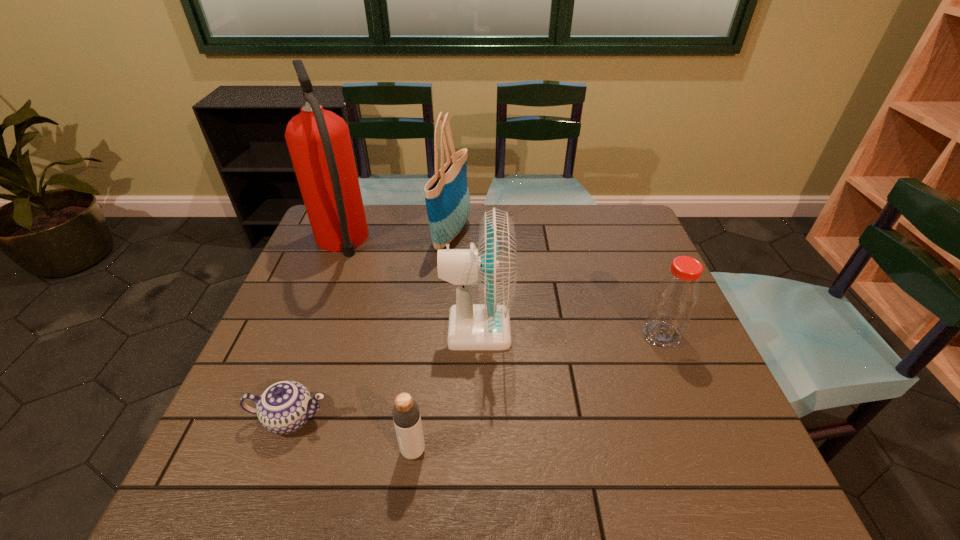
Where is `free point at the far edge`? The width and height of the screenshot is (960, 540). free point at the far edge is located at coordinates (372, 230).

The height and width of the screenshot is (540, 960). Identify the location of vacant region at the near edge of the desktop. (329, 500).

Identify the location of vacant space at the left edge. The width and height of the screenshot is (960, 540). (345, 286).

The height and width of the screenshot is (540, 960). In order to click on blank space at the right edge of the desktop in this screenshot , I will do `click(653, 281)`.

The width and height of the screenshot is (960, 540). I want to click on vacant space at the far right corner, so click(599, 229).

Locate an element on the screen. blank region between the third tallest object and the fire extinguisher is located at coordinates (409, 287).

Locate an element on the screen. This screenshot has width=960, height=540. empty location between the fifth tallest object and the tote bag is located at coordinates (432, 341).

The width and height of the screenshot is (960, 540). I want to click on empty space that is in between the fifth tallest object and the fourth shortest object, so click(445, 390).

You are a GUI agent. You are given a task and a screenshot of the screen. Output one action in this format:
    pyautogui.click(x=<x>, y=<y>)
    Task: Click on the vacant space that's between the farther bottle and the third tallest object
    The width and height of the screenshot is (960, 540).
    Given the screenshot: What is the action you would take?
    pyautogui.click(x=569, y=332)

This screenshot has height=540, width=960. In order to click on free spot between the fan and the rightmost object in this screenshot , I will do `click(569, 332)`.